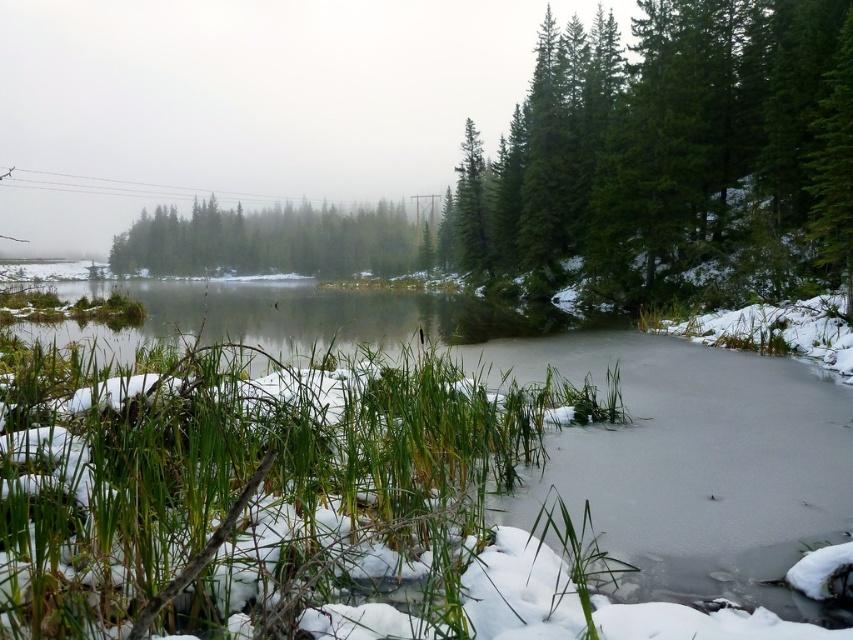
Question: Which object appears closest to the camera in this image?

Choices:
 (A) green matte tree at upper right
 (B) green matte trees at center

Answer: (A)

Question: Does green matte tree at upper right come in front of green matte trees at center?

Choices:
 (A) no
 (B) yes

Answer: (B)

Question: Which point is closer to the camera taking this photo?

Choices:
 (A) (172, 273)
 (B) (778, 180)

Answer: (B)

Question: Can you confirm if green matte tree at upper right is thinner than green matte trees at center?

Choices:
 (A) no
 (B) yes

Answer: (B)

Question: Can you confirm if green matte tree at upper right is bigger than green matte trees at center?

Choices:
 (A) yes
 (B) no

Answer: (B)